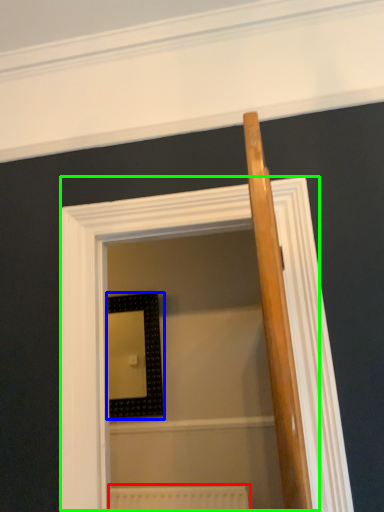
Question: Based on their relative distances, which object is farther from radiator (highlighted by a red box)? Choose from picture frame (highlighted by a blue box) and screen door (highlighted by a green box).

Choices:
 (A) picture frame
 (B) screen door

Answer: (B)